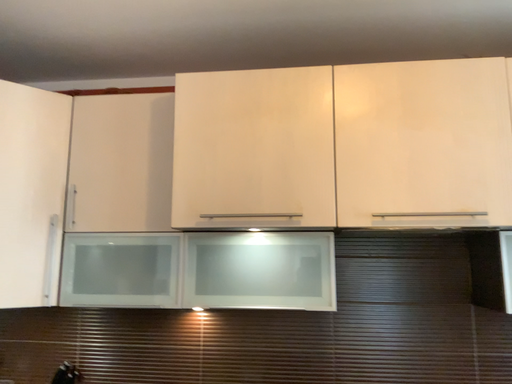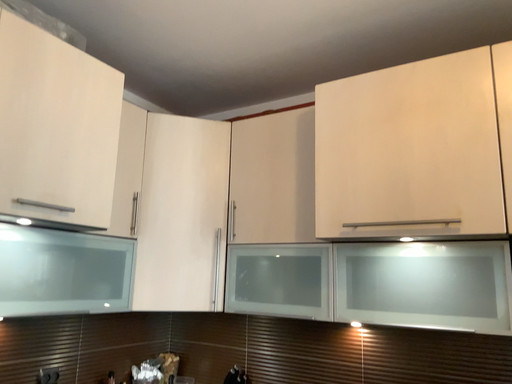
Question: How did the camera likely rotate when shooting the video?

Choices:
 (A) rotated left
 (B) rotated right

Answer: (A)